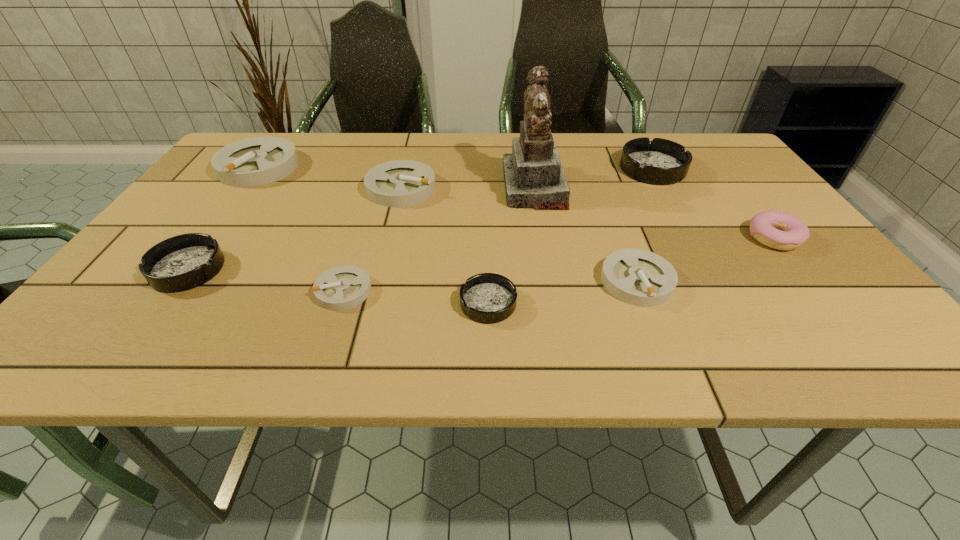
Locate an element on the screen. the second dark ashtray from left to right is located at coordinates (488, 298).

Identify the location of the smallest gray ashtray. This screenshot has height=540, width=960. (343, 287).

Find the location of a particular element. free region located on the front-facing side of the figurine is located at coordinates (438, 187).

The height and width of the screenshot is (540, 960). Find the location of `blank space located on the front-facing side of the figurine`. blank space located on the front-facing side of the figurine is located at coordinates (485, 187).

Locate an element on the screen. free space located on the front-facing side of the figurine is located at coordinates (376, 187).

Locate an element on the screen. vacant space situated on the front of the biggest gray ashtray is located at coordinates (188, 264).

Where is `blank space located on the left of the biggest dark ashtray`? The height and width of the screenshot is (540, 960). blank space located on the left of the biggest dark ashtray is located at coordinates (580, 169).

This screenshot has height=540, width=960. Identify the location of free space located 0.300m on the right of the third smallest gray ashtray. (552, 188).

Where is `vacant space located 0.400m on the left of the rightmost object`? Image resolution: width=960 pixels, height=540 pixels. vacant space located 0.400m on the left of the rightmost object is located at coordinates (569, 238).

The width and height of the screenshot is (960, 540). In order to click on free space located on the right of the leftmost dark ashtray in this screenshot , I will do `click(271, 269)`.